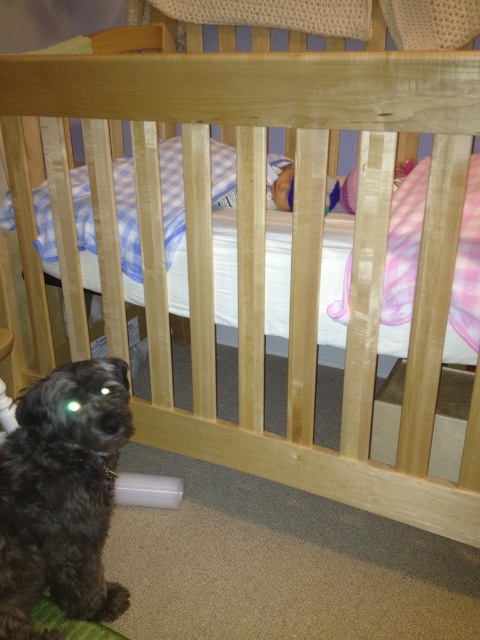
You are a photographer taking a picture of the black fuzzy dog at lower left and the pink satin baby at center. Which subject is positioned closer to the camera?

The black fuzzy dog at lower left is closer to the viewer than the pink satin baby at center, so the dog would appear closer to the camera in the photo.

You are standing in the room and see two points marked on the floor near the crib. The first point is at coordinates point (73, 428) and the second point is at point (236, 198). Which point is closer to you?

Point (73, 428) is in front of point (236, 198), so it is closer to you.